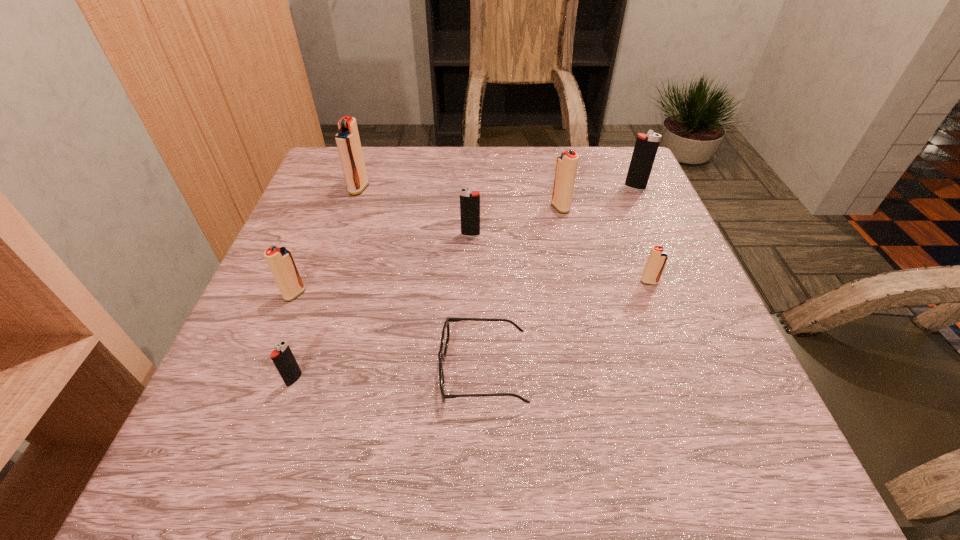
Locate an element on the screen. This screenshot has width=960, height=540. the second closest black igniter to the second black igniter from left to right is located at coordinates coord(283,358).